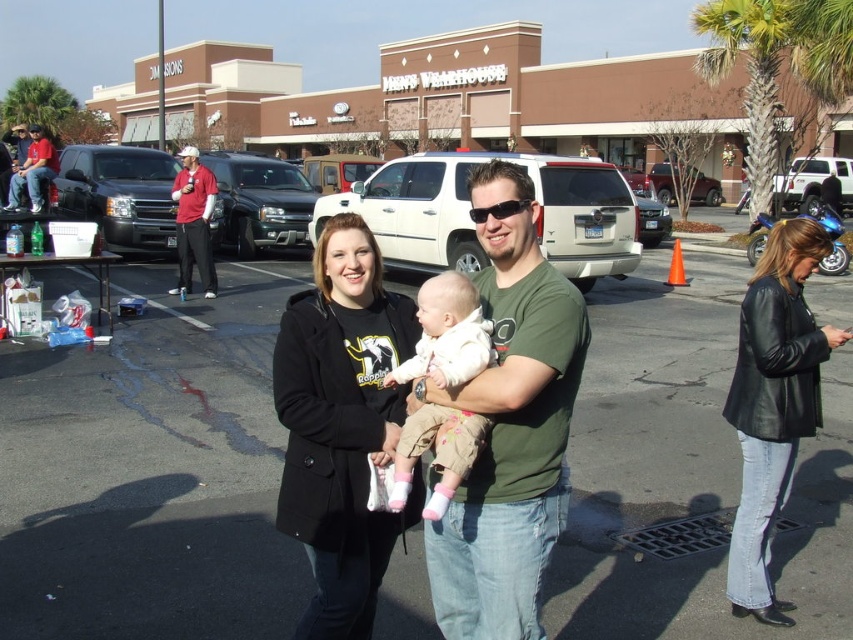
Question: Which object appears closest to the camera in this image?

Choices:
 (A) black leather jacket at lower right
 (B) matte black jacket at upper center
 (C) white fleece baby at center
 (D) brushed metal water at bottle left

Answer: (C)

Question: Is brushed metal water at bottle left to the left of matte white suv at center from the viewer's perspective?

Choices:
 (A) no
 (B) yes

Answer: (B)

Question: Can you confirm if green cotton t-shirt at center is thinner than matte black truck at center?

Choices:
 (A) yes
 (B) no

Answer: (A)

Question: Which point is farther to the camera?

Choices:
 (A) matte black truck at left
 (B) silver metallic suv at center
 (C) matte black truck at center

Answer: (C)

Question: Which point is closer to the camera taking this photo?

Choices:
 (A) (796, 392)
 (B) (616, 294)
 (C) (809, 195)

Answer: (A)

Question: Considering the relative positions of matte black truck at left and silver metallic suv at center in the image provided, where is matte black truck at left located with respect to silver metallic suv at center?

Choices:
 (A) above
 (B) below

Answer: (A)